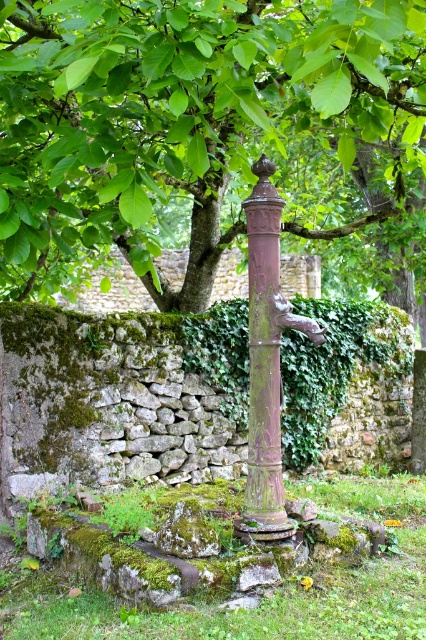
Between green leafy tree at center and rusty metal pole at center, which one appears on the right side from the viewer's perspective?

From the viewer's perspective, rusty metal pole at center appears more on the right side.

Is green leafy tree at center taller than rusty metal pole at center?

No, green leafy tree at center is not taller than rusty metal pole at center.

Which is in front, point (132, 172) or point (276, 436)?

Point (132, 172) is in front.

Identify the location of green leafy tree at center. This screenshot has height=640, width=426. (181, 118).